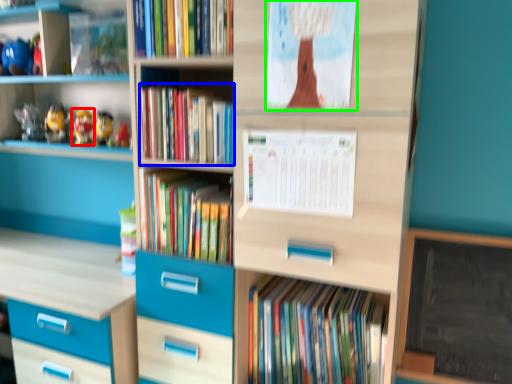
Question: Estimate the real-world distances between objects in this image. Which object is closer to toy (highlighted by a red box), book (highlighted by a blue box) or paperback book (highlighted by a green box)?

Choices:
 (A) book
 (B) paperback book

Answer: (A)